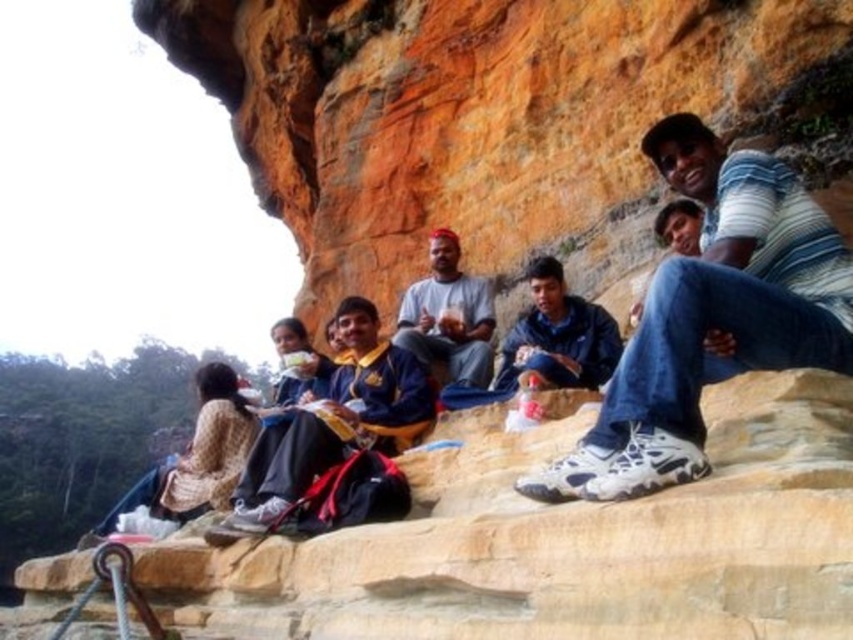
Question: Which object appears closest to the camera in this image?

Choices:
 (A) blue jeans at center
 (B) matte gray shirt at center
 (C) dark blue fabric jacket at center

Answer: (A)

Question: Which object appears farthest from the camera in this image?

Choices:
 (A) dark blue fabric jacket at center
 (B) yellow fabric shirt at center
 (C) yellowish rock at center

Answer: (A)

Question: Where is yellowish rock at center located in relation to dark blue fabric jacket at center in the image?

Choices:
 (A) left
 (B) right

Answer: (A)

Question: Which is nearer to the orange rock at center?

Choices:
 (A) yellow fabric shirt at center
 (B) matte gray shirt at center

Answer: (B)

Question: Can you confirm if yellow fabric shirt at center is smaller than matte gray shirt at center?

Choices:
 (A) yes
 (B) no

Answer: (A)

Question: In this image, where is dark blue fabric jacket at center located relative to matte gray shirt at center?

Choices:
 (A) right
 (B) left

Answer: (A)